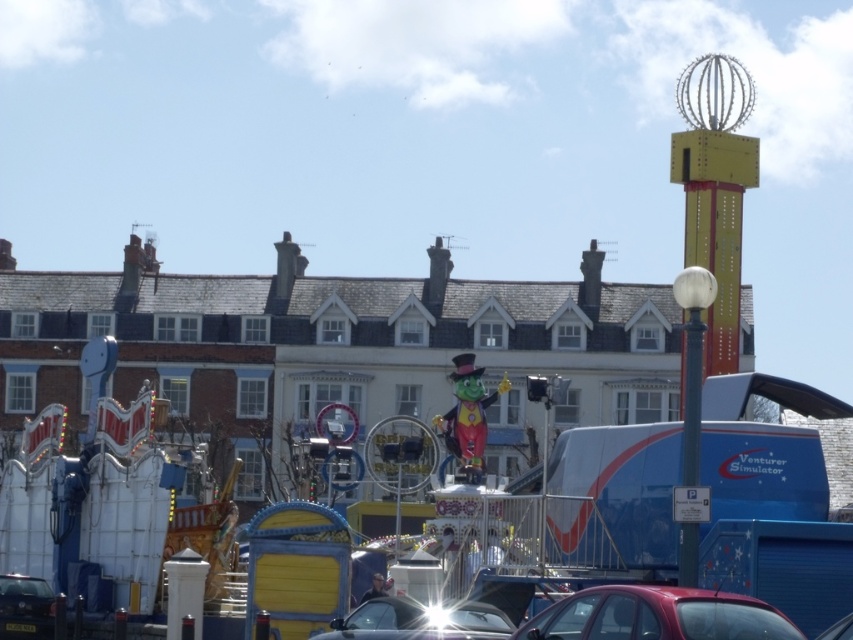
Is point (404, 625) behind point (7, 580)?

No, (404, 625) is in front of (7, 580).

Who is lower down, shiny black car at center or shiny black car at lower left?

shiny black car at lower left is lower down.

This screenshot has width=853, height=640. Find the location of `shiny black car at center`. shiny black car at center is located at coordinates (419, 621).

Locate an element on the screen. shiny black car at center is located at coordinates (419, 621).

Who is lower down, shiny red car at lower right or shiny black car at lower left?

shiny black car at lower left is lower down.

Does shiny red car at lower right appear under shiny black car at lower left?

No.

Describe the element at coordinates (657, 616) in the screenshot. I see `shiny red car at lower right` at that location.

This screenshot has width=853, height=640. Identify the location of shiny red car at lower right. (657, 616).

Is the position of shiny red car at lower right less distant than that of shiny black car at center?

Yes, it is.

Which is below, shiny red car at lower right or shiny black car at center?

shiny black car at center is below.

The image size is (853, 640). What are the coordinates of `shiny red car at lower right` in the screenshot? It's located at (657, 616).